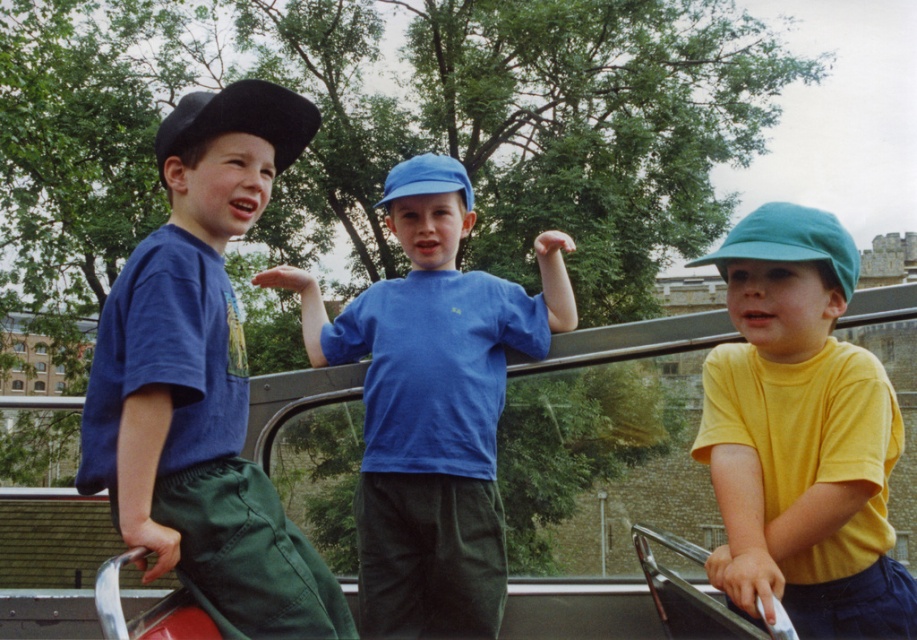
Question: Which object is farther from the camera taking this photo?

Choices:
 (A) matte blue shirt at left
 (B) yellow matte shirt at center
 (C) black matte baseball hat at left

Answer: (C)

Question: Is matte blue shirt at left above blue matte shirt at center?

Choices:
 (A) yes
 (B) no

Answer: (A)

Question: Can you confirm if yellow matte shirt at center is smaller than black matte baseball hat at left?

Choices:
 (A) no
 (B) yes

Answer: (A)

Question: Is blue matte shirt at center below black matte baseball hat at left?

Choices:
 (A) no
 (B) yes

Answer: (B)

Question: Among these points, which one is farthest from the camera?

Choices:
 (A) (280, 93)
 (B) (761, 266)

Answer: (A)

Question: Which point is closer to the camera taking this photo?

Choices:
 (A) coord(440,532)
 (B) coord(322,576)
 (C) coord(244,97)

Answer: (C)